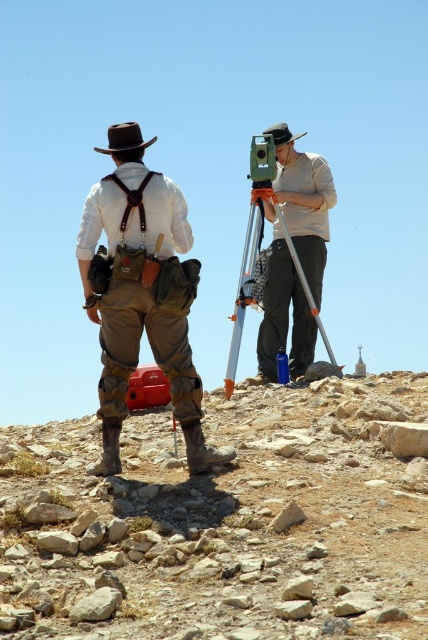
Can you confirm if dusty stone hillside at lower left is wider than brown felt cowboy hat at upper left?

Yes.

Can you confirm if dusty stone hillside at lower left is bigger than brown felt cowboy hat at upper left?

No.

Measure the distance between point (x=278, y=492) and camera.

31.67 meters

This screenshot has height=640, width=428. I want to click on dusty stone hillside at lower left, so click(x=222, y=522).

Does leather suspenders at center have a greater height compared to silver metallic tripod at center?

In fact, leather suspenders at center may be shorter than silver metallic tripod at center.

Which is behind, point (139, 193) or point (234, 307)?

Positioned behind is point (234, 307).

The width and height of the screenshot is (428, 640). What are the coordinates of `leather suspenders at center` in the screenshot? It's located at (142, 300).

The height and width of the screenshot is (640, 428). Describe the element at coordinates (252, 280) in the screenshot. I see `silver metallic tripod at center` at that location.

From the picture: Does silver metallic tripod at center have a larger size compared to brown felt cowboy hat at upper left?

No, silver metallic tripod at center is not bigger than brown felt cowboy hat at upper left.

Between point (317, 324) and point (127, 150), which one is positioned in front?

Point (127, 150) is in front.

Where is `silver metallic tripod at center`? This screenshot has width=428, height=640. silver metallic tripod at center is located at coordinates (252, 280).